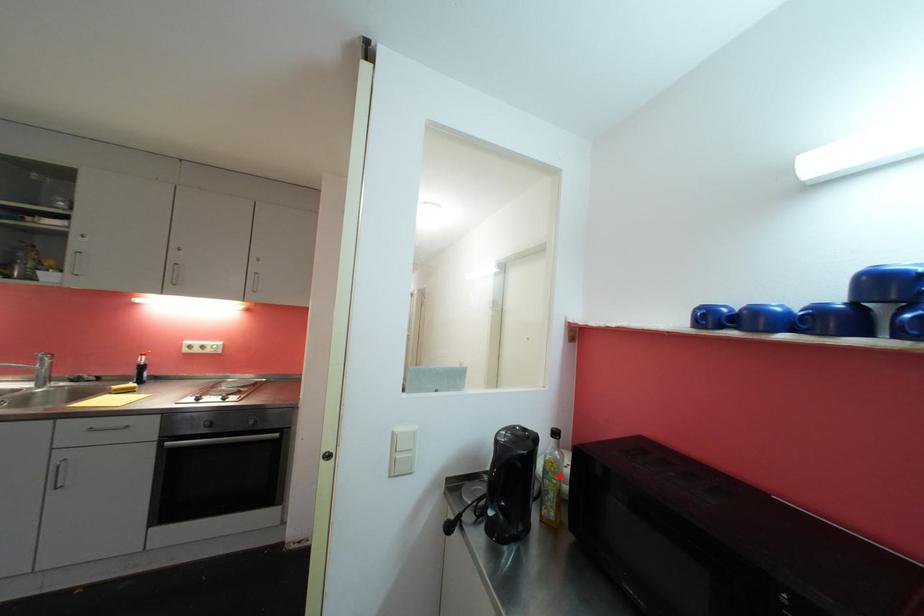
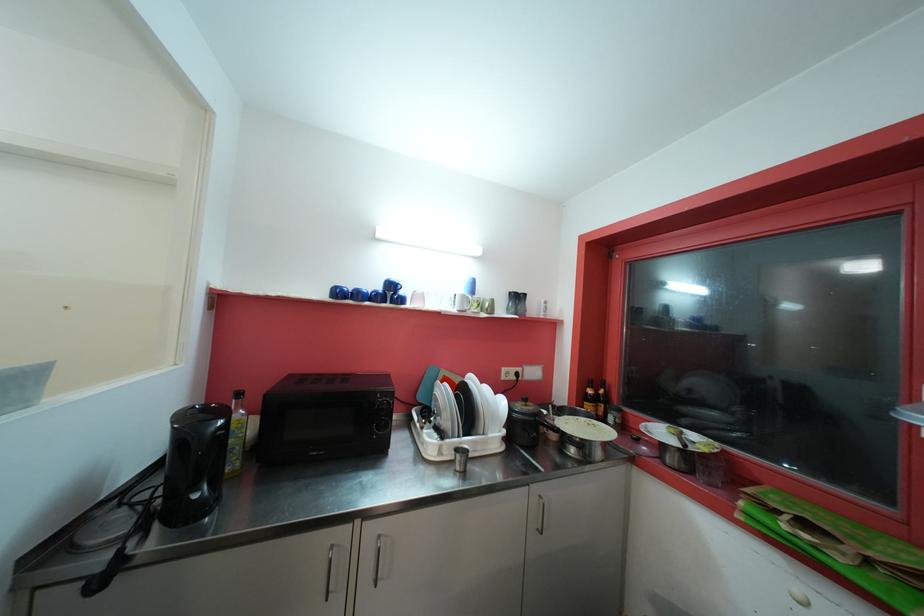
Question: I am providing you with two images of the same scene from different viewpoints. A red point is shown in image1. For the corresponding object point in image2, is it positioned nearer or farther from the camera?

Choices:
 (A) Nearer
 (B) Farther

Answer: (A)